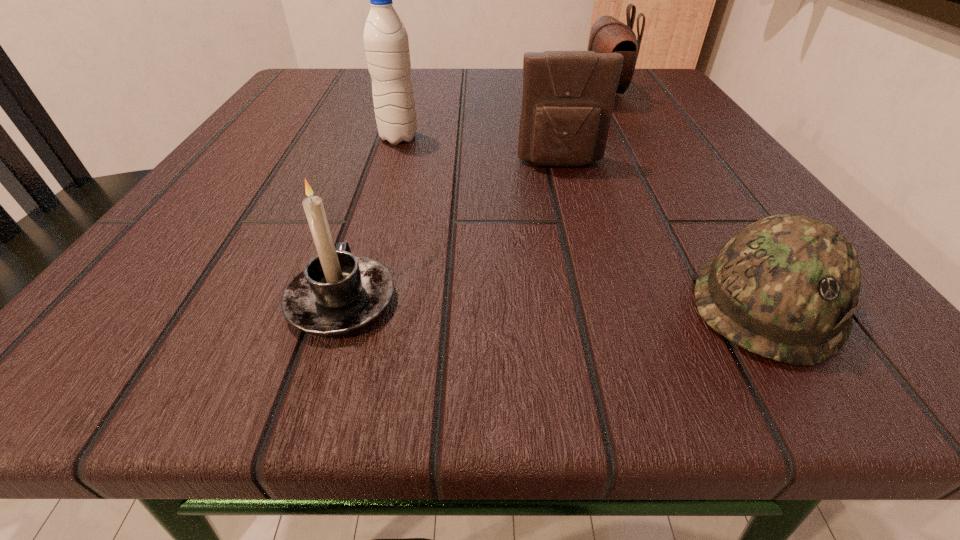
Image resolution: width=960 pixels, height=540 pixels. I want to click on free space between the shortest object and the third object from right to left, so click(664, 233).

At what (x,y) coordinates should I click in order to perform the action: click on free space between the tallest object and the shortest object. Please return your answer as a coordinate pair (x, y). The height and width of the screenshot is (540, 960). Looking at the image, I should click on (583, 220).

Find the location of `vacant area that lies between the third object from right to left and the candle holder`. vacant area that lies between the third object from right to left and the candle holder is located at coordinates (451, 233).

You are a GUI agent. You are given a task and a screenshot of the screen. Output one action in this format:
    pyautogui.click(x=<x>, y=<y>)
    Task: Click on the vacant region between the candle holder and the farthest object
    
    Given the screenshot: What is the action you would take?
    pyautogui.click(x=472, y=197)

Where is `free space that is in between the left pouch and the candle holder`? This screenshot has height=540, width=960. free space that is in between the left pouch and the candle holder is located at coordinates (451, 233).

The height and width of the screenshot is (540, 960). Find the location of `free spot between the tallest object and the left pouch`. free spot between the tallest object and the left pouch is located at coordinates tap(480, 151).

The width and height of the screenshot is (960, 540). I want to click on free area in between the right pouch and the candle holder, so click(x=472, y=197).

Locate an element on the screen. Image resolution: width=960 pixels, height=540 pixels. free space between the tallest object and the farthest object is located at coordinates (501, 116).

Where is `free space between the candle holder and the shortest object`? The image size is (960, 540). free space between the candle holder and the shortest object is located at coordinates (555, 302).

You are a GUI agent. You are given a task and a screenshot of the screen. Output one action in this format:
    pyautogui.click(x=<x>, y=<y>)
    Task: Click on the object identified as the second closest to the water bottle
    
    Given the screenshot: What is the action you would take?
    pyautogui.click(x=336, y=293)